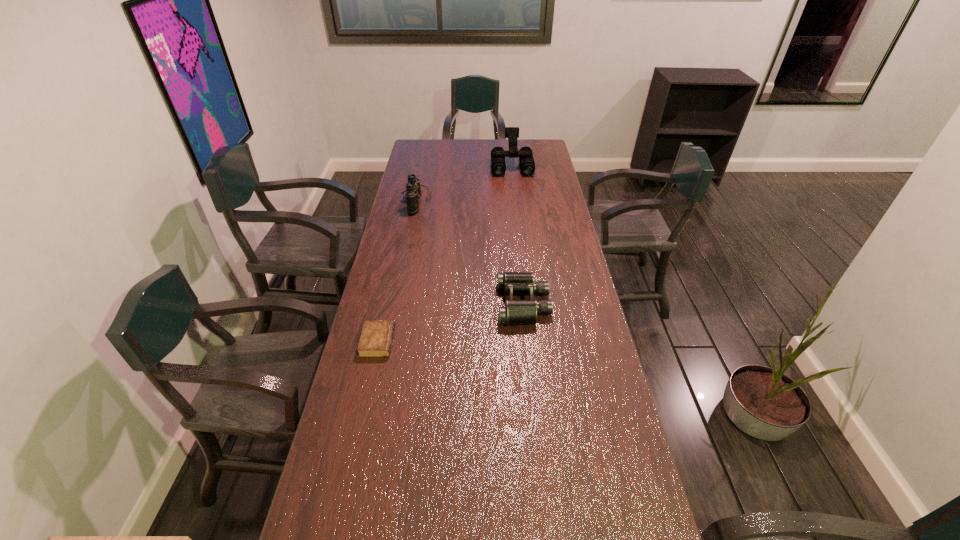
Where is `unoccupied area between the second tallest object and the nearest binoculars`? unoccupied area between the second tallest object and the nearest binoculars is located at coordinates (469, 252).

The image size is (960, 540). In order to click on object that is the closest to the leftmost binoculars in this screenshot , I will do `click(498, 164)`.

The image size is (960, 540). In order to click on the closest object relative to the second shortest object in this screenshot , I will do `click(376, 338)`.

Identify which binoculars is the second closest to the tallest binoculars. Please provide its 2D coordinates. Your answer should be formatted as a tuple, i.e. [(x, y)], where the tuple contains the x and y coordinates of a point satisfying the conditions above.

[(515, 312)]

Point out which binoculars is positioned as the nearest to the diary. Please provide its 2D coordinates. Your answer should be formatted as a tuple, i.e. [(x, y)], where the tuple contains the x and y coordinates of a point satisfying the conditions above.

[(515, 312)]

The width and height of the screenshot is (960, 540). I want to click on free space in the image that satisfies the following two spatial constraints: 1. on the front lenses of the tallest binoculars; 2. on the front-facing side of the second shortest object, so click(528, 304).

This screenshot has width=960, height=540. Identify the location of free space in the image that satisfies the following two spatial constraints: 1. on the front lenses of the farthest object; 2. on the spine side of the diary. (533, 342).